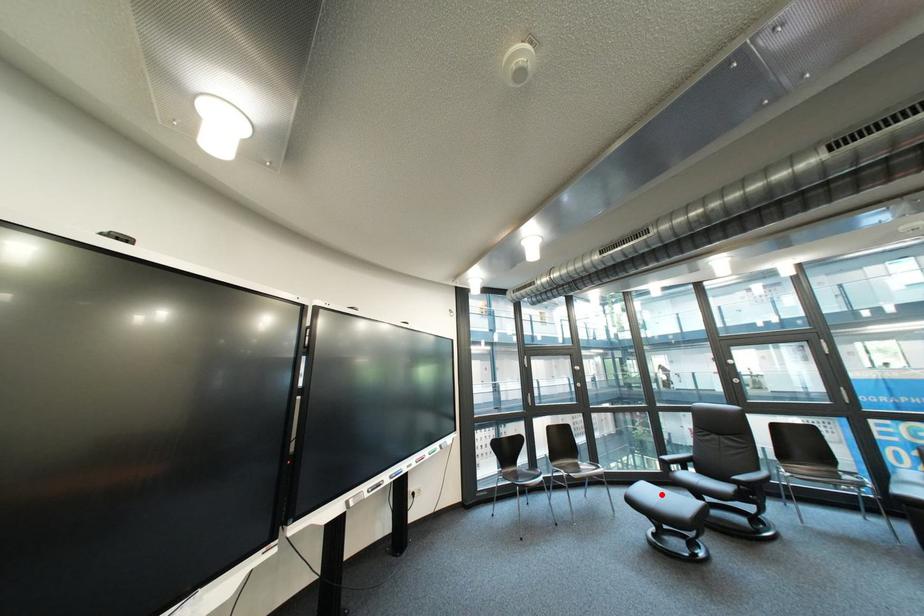
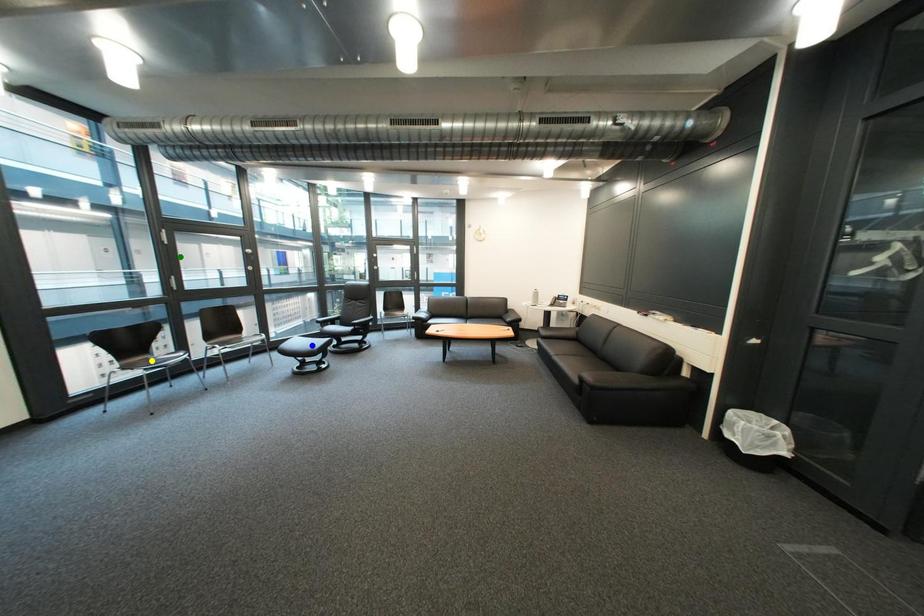
Question: I am providing you with two images of the same scene from different viewpoints. A red point is marked on the first image. You are given multiple points on the second image. Can you choose the point in image 2 that corresponds to the point in image 1?

Choices:
 (A) yellow point
 (B) blue point
 (C) green point

Answer: (B)